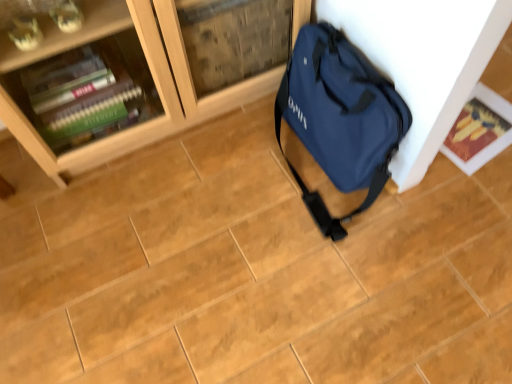
The height and width of the screenshot is (384, 512). What are the coordinates of `blue fabric bag at right` in the screenshot? It's located at (340, 118).

Based on the photo, what is the approximate width of blue fabric bag at right?

9.92 inches.

Describe the element at coordinates (340, 118) in the screenshot. Image resolution: width=512 pixels, height=384 pixels. I see `blue fabric bag at right` at that location.

Where is `blue fabric bag at right`? Image resolution: width=512 pixels, height=384 pixels. blue fabric bag at right is located at coordinates (340, 118).